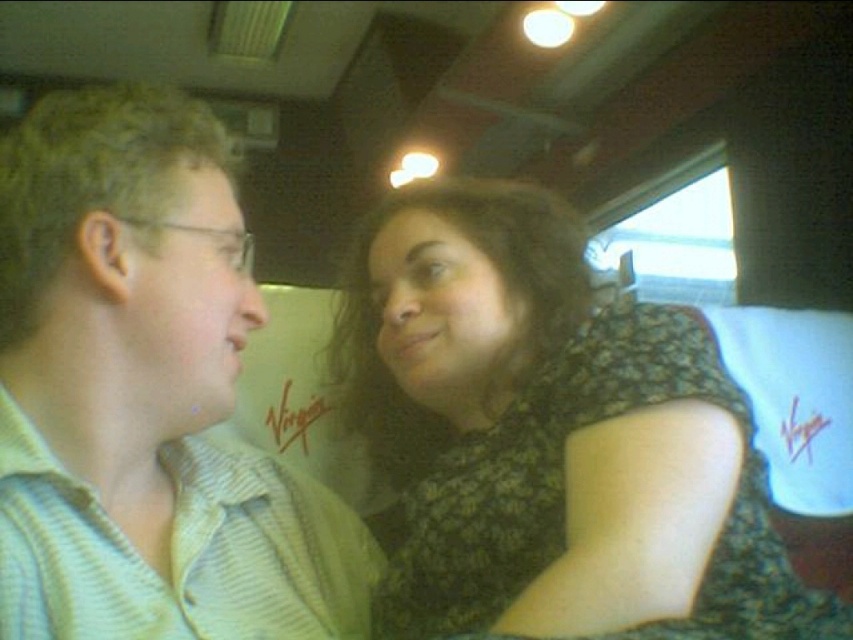
Question: Among these objects, which one is farthest from the camera?

Choices:
 (A) striped cotton shirt at left
 (B) black lace dress at center

Answer: (B)

Question: Is black lace dress at center further to camera compared to striped cotton shirt at left?

Choices:
 (A) yes
 (B) no

Answer: (A)

Question: Does black lace dress at center appear over striped cotton shirt at left?

Choices:
 (A) yes
 (B) no

Answer: (B)

Question: Is black lace dress at center wider than striped cotton shirt at left?

Choices:
 (A) yes
 (B) no

Answer: (A)